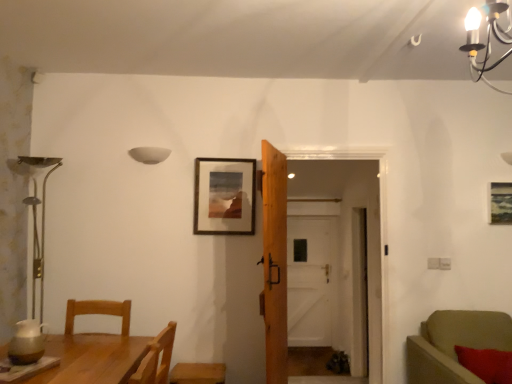
Question: Is white wooden door at center, acting as the 2th door starting from the left, at the back of wooden table at lower left?

Choices:
 (A) no
 (B) yes

Answer: (A)

Question: Is wooden table at lower left positioned behind white wooden door at center, acting as the 2th door starting from the left?

Choices:
 (A) no
 (B) yes

Answer: (A)

Question: Can you confirm if wooden table at lower left is wider than white wooden door at center, the 1th door in the back-to-front sequence?

Choices:
 (A) yes
 (B) no

Answer: (A)

Question: From a real-world perspective, is wooden table at lower left positioned over white wooden door at center, the second door from the front, based on gravity?

Choices:
 (A) no
 (B) yes

Answer: (B)

Question: Considering the relative positions of wooden table at lower left and white wooden door at center, acting as the 2th door starting from the left, in the image provided, is wooden table at lower left to the right of white wooden door at center, acting as the 2th door starting from the left, from the viewer's perspective?

Choices:
 (A) no
 (B) yes

Answer: (A)

Question: Is wooden table at lower left far from white wooden door at center, the second door from the front?

Choices:
 (A) yes
 (B) no

Answer: (A)

Question: Is the position of white matte bowl at upper center less distant than that of wooden picture frame at upper right, positioned as the 1th picture frame in right-to-left order?

Choices:
 (A) yes
 (B) no

Answer: (A)

Question: Does white matte bowl at upper center have a smaller size compared to wooden picture frame at upper right, the second picture frame when ordered from left to right?

Choices:
 (A) yes
 (B) no

Answer: (A)

Question: Is white matte bowl at upper center positioned beyond the bounds of wooden picture frame at upper right, the second picture frame when ordered from left to right?

Choices:
 (A) yes
 (B) no

Answer: (A)

Question: Is white matte bowl at upper center in contact with wooden picture frame at upper right, positioned as the 1th picture frame in right-to-left order?

Choices:
 (A) yes
 (B) no

Answer: (B)

Question: Considering the relative sizes of white matte bowl at upper center and wooden picture frame at upper right, positioned as the 1th picture frame in right-to-left order, in the image provided, is white matte bowl at upper center bigger than wooden picture frame at upper right, positioned as the 1th picture frame in right-to-left order,?

Choices:
 (A) no
 (B) yes

Answer: (A)

Question: Is white matte bowl at upper center facing towards wooden picture frame at upper right, positioned as the 1th picture frame in right-to-left order?

Choices:
 (A) no
 (B) yes

Answer: (A)

Question: Is wooden picture frame at center, arranged as the 1th picture frame when viewed from the left, to the right of white wooden door at center, the second door from the front, from the viewer's perspective?

Choices:
 (A) no
 (B) yes

Answer: (A)